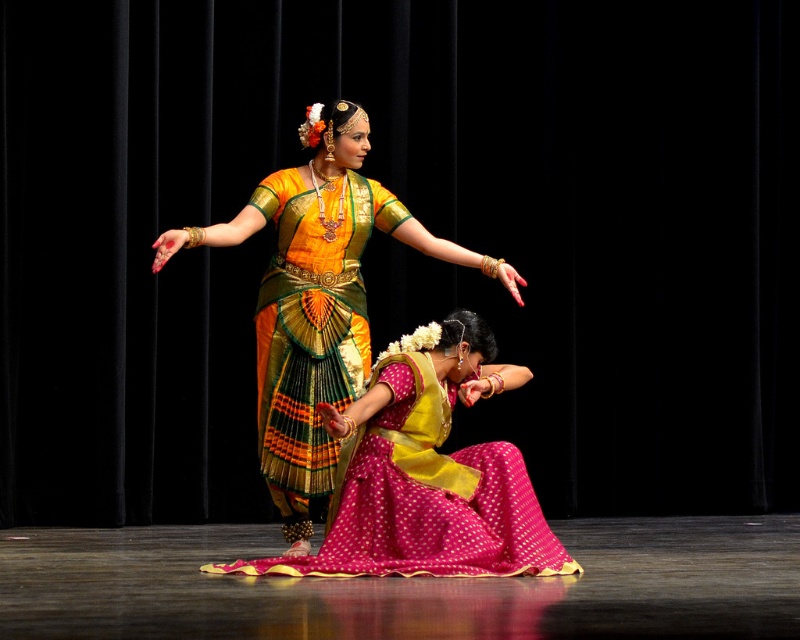
Question: Does pink satin saree at center have a smaller size compared to golden silk saree at center?

Choices:
 (A) yes
 (B) no

Answer: (A)

Question: Among these objects, which one is nearest to the camera?

Choices:
 (A) pink satin saree at center
 (B) shiny silk saree at center

Answer: (A)

Question: Which of the following is the farthest from the observer?

Choices:
 (A) (326, 166)
 (B) (272, 381)

Answer: (A)

Question: Based on their relative distances, which object is nearer to the pink satin saree at center?

Choices:
 (A) shiny silk saree at center
 (B) golden silk saree at center

Answer: (A)

Question: Does pink satin saree at center have a larger size compared to shiny silk saree at center?

Choices:
 (A) yes
 (B) no

Answer: (A)

Question: Where is golden silk saree at center located in relation to shiny silk saree at center in the image?

Choices:
 (A) above
 (B) below

Answer: (A)